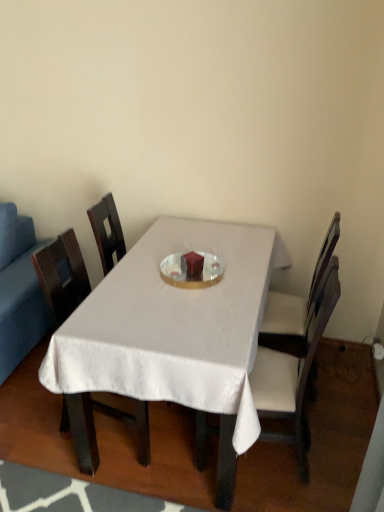
The height and width of the screenshot is (512, 384). In order to click on white fabric chair at center, marked as the 2th chair in a left-to-right arrangement in this screenshot , I will do `click(293, 368)`.

What is the approximate height of white satin table at center?

It is 30.70 inches.

Where is `blue fabric couch at left`? Image resolution: width=384 pixels, height=512 pixels. blue fabric couch at left is located at coordinates (19, 290).

Looking at the image, does wooden chair at center, which is the 3th chair from right to left, seem bigger or smaller compared to white fabric chair at center, the second chair from the right?

Considering their sizes, wooden chair at center, which is the 3th chair from right to left, takes up less space than white fabric chair at center, the second chair from the right.

Considering their positions, is wooden chair at center, marked as the first chair in a left-to-right arrangement, located in front of or behind white fabric chair at center, the second chair from the right?

wooden chair at center, marked as the first chair in a left-to-right arrangement, is positioned farther from the viewer than white fabric chair at center, the second chair from the right.

Is wooden chair at center, marked as the first chair in a left-to-right arrangement, facing towards white fabric chair at center, marked as the 2th chair in a left-to-right arrangement?

Yes, wooden chair at center, marked as the first chair in a left-to-right arrangement, is oriented towards white fabric chair at center, marked as the 2th chair in a left-to-right arrangement.

From a real-world perspective, who is located higher, wooden chair at center, marked as the first chair in a left-to-right arrangement, or white fabric chair at center, the second chair from the right?

white fabric chair at center, the second chair from the right, is physically above.

Is blue fabric couch at left positioned beyond the bounds of white satin table at center?

Absolutely, blue fabric couch at left is external to white satin table at center.

Which of these two, blue fabric couch at left or white satin table at center, is wider?

white satin table at center.

Consider the image. From the image's perspective, is blue fabric couch at left under white satin table at center?

No.

Does blue fabric couch at left appear on the right side of white satin table at center?

No.

In the scene shown: How far apart are blue fabric couch at left and white fabric chair at center, which is counted as the first chair, starting from the right?

blue fabric couch at left and white fabric chair at center, which is counted as the first chair, starting from the right, are 1.36 meters apart from each other.

From a real-world perspective, who is located lower, blue fabric couch at left or white fabric chair at center, which is counted as the first chair, starting from the right?

→ blue fabric couch at left, from a real-world perspective.

Locate an element on the screen. The image size is (384, 512). studio couch on the left of white fabric chair at center, arranged as the 3th chair when viewed from the left is located at coordinates (19, 290).

Based on the photo, from the image's perspective, is blue fabric couch at left over white fabric chair at center, which is counted as the first chair, starting from the right?

Yes, from the image's perspective, blue fabric couch at left is above white fabric chair at center, which is counted as the first chair, starting from the right.

At what (x,y) coordinates should I click in order to perform the action: click on chair that is the 3rd object located below the blue fabric couch at left (from the image's perspective). Please return your answer as a coordinate pair (x, y). This screenshot has width=384, height=512. Looking at the image, I should click on (293, 368).

Is white fabric chair at center, marked as the 2th chair in a left-to-right arrangement, bigger or smaller than blue fabric couch at left?

Clearly, white fabric chair at center, marked as the 2th chair in a left-to-right arrangement, is smaller in size than blue fabric couch at left.

Which object is further away from the camera taking this photo, white fabric chair at center, the second chair from the right, or blue fabric couch at left?

blue fabric couch at left is further from the camera.

Is white fabric chair at center, the second chair from the right, shorter than blue fabric couch at left?

No.

Does white fabric chair at center, which is counted as the first chair, starting from the right, turn towards white satin table at center?

Yes, white fabric chair at center, which is counted as the first chair, starting from the right, is aimed at white satin table at center.

Can you confirm if white fabric chair at center, arranged as the 3th chair when viewed from the left, is bigger than white satin table at center?

Actually, white fabric chair at center, arranged as the 3th chair when viewed from the left, might be smaller than white satin table at center.

Measure the distance from white fabric chair at center, which is counted as the first chair, starting from the right, to white satin table at center.

white fabric chair at center, which is counted as the first chair, starting from the right, and white satin table at center are 18.02 inches apart.

Between white fabric chair at center, arranged as the 3th chair when viewed from the left, and white satin table at center, which one has smaller width?

white fabric chair at center, arranged as the 3th chair when viewed from the left.

Does white fabric chair at center, arranged as the 3th chair when viewed from the left, have a lesser width compared to blue fabric couch at left?

Yes.

Is white fabric chair at center, which is counted as the first chair, starting from the right, in front of or behind blue fabric couch at left in the image?

white fabric chair at center, which is counted as the first chair, starting from the right, is in front of blue fabric couch at left.

Looking at this image, from a real-world perspective, which object stands above the other?

white fabric chair at center, which is counted as the first chair, starting from the right.

Does blue fabric couch at left contain wooden chair at center, marked as the first chair in a left-to-right arrangement?

A: No, blue fabric couch at left does not contain wooden chair at center, marked as the first chair in a left-to-right arrangement.

How different are the orientations of blue fabric couch at left and wooden chair at center, which is the 3th chair from right to left, in degrees?

The facing directions of blue fabric couch at left and wooden chair at center, which is the 3th chair from right to left, are 88.6 degrees apart.

Considering the sizes of objects blue fabric couch at left and wooden chair at center, marked as the first chair in a left-to-right arrangement, in the image provided, who is thinner, blue fabric couch at left or wooden chair at center, marked as the first chair in a left-to-right arrangement,?

wooden chair at center, marked as the first chair in a left-to-right arrangement.

Can you confirm if blue fabric couch at left is shorter than wooden chair at center, marked as the first chair in a left-to-right arrangement?

Correct, blue fabric couch at left is not as tall as wooden chair at center, marked as the first chair in a left-to-right arrangement.

Which chair is the 1st one when counting from the back of the white fabric chair at center, the second chair from the right? Please provide its 2D coordinates.

[(94, 428)]

The width and height of the screenshot is (384, 512). In order to click on desk below the blue fabric couch at left (from the image's perspective) in this screenshot , I will do `click(175, 332)`.

Based on their spatial positions, is blue fabric couch at left or wooden chair at center, marked as the first chair in a left-to-right arrangement, closer to white satin table at center?

wooden chair at center, marked as the first chair in a left-to-right arrangement, is positioned closer to the anchor white satin table at center.

Looking at the image, which one is located closer to white fabric chair at center, which is counted as the first chair, starting from the right, white satin table at center or blue fabric couch at left?

white satin table at center lies closer to white fabric chair at center, which is counted as the first chair, starting from the right, than the other object.

Looking at the image, which one is located closer to blue fabric couch at left, white fabric chair at center, arranged as the 3th chair when viewed from the left, or white satin table at center?

white satin table at center is closer to blue fabric couch at left.

From the image, which object appears to be nearer to blue fabric couch at left, white fabric chair at center, the second chair from the right, or white fabric chair at center, arranged as the 3th chair when viewed from the left?

Based on the image, white fabric chair at center, the second chair from the right, appears to be nearer to blue fabric couch at left.

Looking at the image, which one is located further to wooden chair at center, marked as the first chair in a left-to-right arrangement, blue fabric couch at left or white satin table at center?

Based on the image, blue fabric couch at left appears to be further to wooden chair at center, marked as the first chair in a left-to-right arrangement.

Which object lies nearer to the anchor point white satin table at center, wooden chair at center, marked as the first chair in a left-to-right arrangement, or white fabric chair at center, arranged as the 3th chair when viewed from the left?

white fabric chair at center, arranged as the 3th chair when viewed from the left, is positioned closer to the anchor white satin table at center.

Based on their spatial positions, is blue fabric couch at left or white satin table at center further from white fabric chair at center, which is counted as the first chair, starting from the right?

The object further to white fabric chair at center, which is counted as the first chair, starting from the right, is blue fabric couch at left.

When comparing their distances from wooden chair at center, which is the 3th chair from right to left, does white satin table at center or white fabric chair at center, arranged as the 3th chair when viewed from the left, seem further?

Among the two, white fabric chair at center, arranged as the 3th chair when viewed from the left, is located further to wooden chair at center, which is the 3th chair from right to left.

Image resolution: width=384 pixels, height=512 pixels. Identify the location of chair between wooden chair at center, which is the 3th chair from right to left, and white fabric chair at center, which is counted as the first chair, starting from the right, in the horizontal direction. click(293, 368).

Locate an element on the screen. This screenshot has width=384, height=512. chair between blue fabric couch at left and white fabric chair at center, marked as the 2th chair in a left-to-right arrangement, from left to right is located at coordinates (94, 428).

I want to click on chair between blue fabric couch at left and white satin table at center in the horizontal direction, so click(x=94, y=428).

The image size is (384, 512). What are the coordinates of `desk between wooden chair at center, which is the 3th chair from right to left, and white fabric chair at center, the second chair from the right` in the screenshot? It's located at (175, 332).